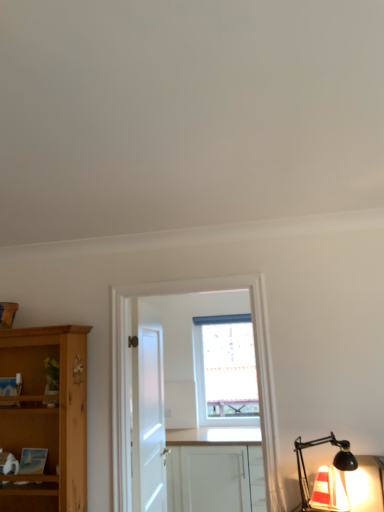
Locate an element on the screen. white matte door at center is located at coordinates (148, 418).

Find the location of `transparent glass window at center`. transparent glass window at center is located at coordinates (225, 368).

The height and width of the screenshot is (512, 384). Find the location of `white matte cabinet at center`. white matte cabinet at center is located at coordinates (215, 470).

Measure the distance between translucent glass lamp at lower right and camera.

They are 5.98 feet apart.

Locate an element on the screen. white wooden cabinet at center is located at coordinates (257, 376).

This screenshot has width=384, height=512. In order to click on white matte door at center in this screenshot , I will do `click(148, 418)`.

From the picture: Considering the sizes of objects translucent glass lamp at lower right and white wooden cabinet at center in the image provided, who is wider, translucent glass lamp at lower right or white wooden cabinet at center?

translucent glass lamp at lower right.

Can you confirm if translucent glass lamp at lower right is smaller than white wooden cabinet at center?

Yes.

Consider the image. Can you tell me how much translucent glass lamp at lower right and white wooden cabinet at center differ in facing direction?

They differ by 3.12 degrees in their facing directions.

Is translucent glass lamp at lower right at the left side of white wooden cabinet at center?

In fact, translucent glass lamp at lower right is to the right of white wooden cabinet at center.

Are white matte cabinet at center and translucent glass lamp at lower right far apart?

That's right, there is a large distance between white matte cabinet at center and translucent glass lamp at lower right.

Is white matte cabinet at center positioned before translucent glass lamp at lower right?

No, white matte cabinet at center is behind translucent glass lamp at lower right.

From the image's perspective, is white matte cabinet at center located above or below translucent glass lamp at lower right?

From the image's perspective, white matte cabinet at center appears below translucent glass lamp at lower right.

Identify the location of light fixture on the right of white matte cabinet at center. (326, 477).

This screenshot has height=512, width=384. What are the coordinates of `door below the translucent glass lamp at lower right (from the image's perspective)` in the screenshot? It's located at (148, 418).

From the image's perspective, between white matte door at center and translucent glass lamp at lower right, which one is located above?

From the image's view, translucent glass lamp at lower right is above.

Does white matte door at center have a larger size compared to translucent glass lamp at lower right?

Yes, white matte door at center is bigger than translucent glass lamp at lower right.

Is white matte door at center at the left side of transparent glass window at center?

Yes.

Between white matte door at center and transparent glass window at center, which one has more height?

Standing taller between the two is white matte door at center.

Is point (220, 329) closer to viewer compared to point (140, 443)?

No, (220, 329) is behind (140, 443).

Find the location of a particular element. door on the left side of transparent glass window at center is located at coordinates (148, 418).

Does transparent glass window at center touch white matte door at center?

They are not placed beside each other.

Is white wooden cabinet at center aimed at transparent glass window at center?

No, white wooden cabinet at center is not aimed at transparent glass window at center.

From a real-world perspective, is white wooden cabinet at center positioned over transparent glass window at center based on gravity?

Yes, from a real-world perspective, white wooden cabinet at center is above transparent glass window at center.

Based on the photo, can you tell me how much white wooden cabinet at center and transparent glass window at center differ in facing direction?

0.555 degrees.

Where is `entertainment center that appears in front of the transparent glass window at center`? The width and height of the screenshot is (384, 512). entertainment center that appears in front of the transparent glass window at center is located at coordinates (257, 376).

From the image's perspective, is white wooden cabinet at center located above white matte cabinet at center?

Yes, from the image's perspective, white wooden cabinet at center is above white matte cabinet at center.

How different are the orientations of white wooden cabinet at center and white matte cabinet at center in degrees?

They differ by 0.553 degrees in their facing directions.

Does white wooden cabinet at center have a smaller size compared to white matte cabinet at center?

Yes.

Considering the positions of objects white wooden cabinet at center and white matte cabinet at center in the image provided, who is more to the right, white wooden cabinet at center or white matte cabinet at center?

From the viewer's perspective, white matte cabinet at center appears more on the right side.

Identify the location of entertainment center behind the translucent glass lamp at lower right. (257, 376).

Identify the location of cabinetry below the translucent glass lamp at lower right (from the image's perspective). Image resolution: width=384 pixels, height=512 pixels. (215, 470).

Based on their spatial positions, is white wooden cabinet at center or transparent glass window at center closer to white matte door at center?

white wooden cabinet at center is positioned closer to the anchor white matte door at center.

Based on their spatial positions, is transparent glass window at center or white matte door at center closer to translucent glass lamp at lower right?

The object closer to translucent glass lamp at lower right is white matte door at center.

From the image, which object appears to be farther from translucent glass lamp at lower right, transparent glass window at center or white matte cabinet at center?

transparent glass window at center is further to translucent glass lamp at lower right.

Estimate the real-world distances between objects in this image. Which object is further from white matte cabinet at center, transparent glass window at center or translucent glass lamp at lower right?

Based on the image, translucent glass lamp at lower right appears to be further to white matte cabinet at center.

When comparing their distances from white matte door at center, does white matte cabinet at center or transparent glass window at center seem further?

The object further to white matte door at center is transparent glass window at center.

Estimate the real-world distances between objects in this image. Which object is closer to transparent glass window at center, white wooden cabinet at center or white matte door at center?

white matte door at center is closer to transparent glass window at center.

Looking at the image, which one is located further to transparent glass window at center, translucent glass lamp at lower right or white matte cabinet at center?

translucent glass lamp at lower right.

Looking at the image, which one is located further to translucent glass lamp at lower right, white matte cabinet at center or white matte door at center?

white matte cabinet at center is further to translucent glass lamp at lower right.

In order to click on cabinetry positioned between white matte door at center and transparent glass window at center from near to far in this screenshot , I will do `click(215, 470)`.

The height and width of the screenshot is (512, 384). In order to click on door located between white wooden cabinet at center and transparent glass window at center in the depth direction in this screenshot , I will do `click(148, 418)`.

This screenshot has height=512, width=384. I want to click on door between translucent glass lamp at lower right and white matte cabinet at center along the z-axis, so (148, 418).

I want to click on entertainment center between white matte door at center and translucent glass lamp at lower right in the horizontal direction, so click(x=257, y=376).